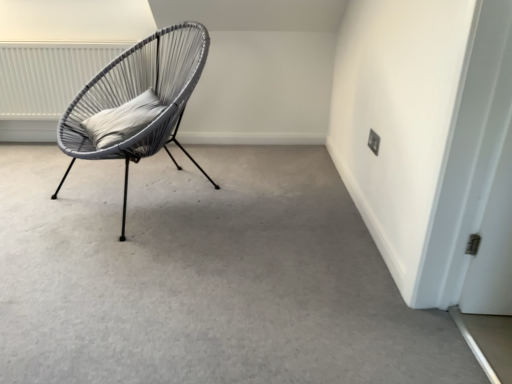
What do you see at coordinates (204, 276) in the screenshot? I see `matte gray carpet at center` at bounding box center [204, 276].

Locate an element on the screen. This screenshot has width=512, height=384. matte gray carpet at center is located at coordinates (204, 276).

What do you see at coordinates (122, 120) in the screenshot? I see `white soft cushion at center` at bounding box center [122, 120].

What is the approximate width of matte grey wicker chair at left?

It is 31.45 inches.

Locate an element on the screen. black plastic electric outlet at upper right is located at coordinates (373, 142).

Image resolution: width=512 pixels, height=384 pixels. What are the coordinates of `matte gray carpet at center` in the screenshot? It's located at (204, 276).

Is matte grey wicker chair at left oriented towards matte gray carpet at center?

No.

Considering the positions of point (166, 61) and point (337, 367), is point (166, 61) closer or farther from the camera than point (337, 367)?

Clearly, point (166, 61) is more distant from the camera than point (337, 367).

Considering the sizes of objects matte grey wicker chair at left and matte gray carpet at center in the image provided, who is taller, matte grey wicker chair at left or matte gray carpet at center?

Standing taller between the two is matte grey wicker chair at left.

Between matte grey wicker chair at left and matte gray carpet at center, which one has larger size?

Bigger between the two is matte grey wicker chair at left.

Which is closer, (378,142) or (139,107)?

The point (378,142) is more forward.

Who is more distant, black plastic electric outlet at upper right or white soft cushion at center?

black plastic electric outlet at upper right is more distant.

From their relative heights in the image, would you say black plastic electric outlet at upper right is taller or shorter than white soft cushion at center?

Clearly, black plastic electric outlet at upper right is shorter compared to white soft cushion at center.

How many degrees apart are the facing directions of black plastic electric outlet at upper right and white soft cushion at center?

There is a 28.9-degree angle between the facing directions of black plastic electric outlet at upper right and white soft cushion at center.

What's the angular difference between matte grey wicker chair at left and white textured radiator at upper left's facing directions?

The facing directions of matte grey wicker chair at left and white textured radiator at upper left are 38.6 degrees apart.

From the image's perspective, does matte grey wicker chair at left appear lower than white textured radiator at upper left?

Yes, from the image's perspective, matte grey wicker chair at left is below white textured radiator at upper left.

Measure the distance between matte grey wicker chair at left and white textured radiator at upper left.

They are 68.30 centimeters apart.

Which is behind, point (91, 157) or point (62, 77)?

The point (62, 77) is farther.

This screenshot has width=512, height=384. Find the location of `concrete below the white soft cushion at center (from a real-world perspective)`. concrete below the white soft cushion at center (from a real-world perspective) is located at coordinates (204, 276).

Looking at this image, which of these two, matte gray carpet at center or white soft cushion at center, is smaller?

With smaller size is white soft cushion at center.

Can you confirm if matte gray carpet at center is shorter than white soft cushion at center?

Correct, matte gray carpet at center is not as tall as white soft cushion at center.

Considering the sizes of objects white soft cushion at center and black plastic electric outlet at upper right in the image provided, who is smaller, white soft cushion at center or black plastic electric outlet at upper right?

black plastic electric outlet at upper right is smaller.

Looking at this image, how many degrees apart are the facing directions of white soft cushion at center and black plastic electric outlet at upper right?

The angle between the facing direction of white soft cushion at center and the facing direction of black plastic electric outlet at upper right is 28.9 degrees.

Is white soft cushion at center to the right of black plastic electric outlet at upper right from the viewer's perspective?

In fact, white soft cushion at center is to the left of black plastic electric outlet at upper right.

Measure the distance between white soft cushion at center and black plastic electric outlet at upper right.

white soft cushion at center and black plastic electric outlet at upper right are 1.17 meters apart from each other.

Can you confirm if black plastic electric outlet at upper right is positioned to the left of white textured radiator at upper left?

In fact, black plastic electric outlet at upper right is to the right of white textured radiator at upper left.

In the image, there is a black plastic electric outlet at upper right. Where is `radiator above it (from the image's perspective)`? radiator above it (from the image's perspective) is located at coordinates pyautogui.click(x=48, y=76).

Between black plastic electric outlet at upper right and white textured radiator at upper left, which one has smaller size?

black plastic electric outlet at upper right.

Is black plastic electric outlet at upper right completely or partially outside of white textured radiator at upper left?

black plastic electric outlet at upper right is positioned outside white textured radiator at upper left.

Is the position of white textured radiator at upper left less distant than that of matte grey wicker chair at left?

No, white textured radiator at upper left is further to the viewer.

Considering the positions of objects white textured radiator at upper left and matte grey wicker chair at left in the image provided, who is more to the right, white textured radiator at upper left or matte grey wicker chair at left?

matte grey wicker chair at left.

Which point is more forward, (32, 119) or (141, 46)?

The point (141, 46) is more forward.

Locate an element on the screen. Image resolution: width=512 pixels, height=384 pixels. concrete in front of the matte grey wicker chair at left is located at coordinates (204, 276).

At what (x,y) coordinates should I click in order to perform the action: click on electric outlet that appears below the white soft cushion at center (from the image's perspective). Please return your answer as a coordinate pair (x, y). The width and height of the screenshot is (512, 384). Looking at the image, I should click on (373, 142).

When comparing their distances from black plastic electric outlet at upper right, does white textured radiator at upper left or matte grey wicker chair at left seem closer?

matte grey wicker chair at left is closer to black plastic electric outlet at upper right.

Estimate the real-world distances between objects in this image. Which object is further from black plastic electric outlet at upper right, white soft cushion at center or matte grey wicker chair at left?

Among the two, white soft cushion at center is located further to black plastic electric outlet at upper right.

Estimate the real-world distances between objects in this image. Which object is further from matte grey wicker chair at left, white soft cushion at center or matte gray carpet at center?

Among the two, matte gray carpet at center is located further to matte grey wicker chair at left.

From the image, which object appears to be farther from matte grey wicker chair at left, black plastic electric outlet at upper right or white textured radiator at upper left?

black plastic electric outlet at upper right is positioned further to the anchor matte grey wicker chair at left.

Based on their spatial positions, is matte grey wicker chair at left or black plastic electric outlet at upper right further from white textured radiator at upper left?

black plastic electric outlet at upper right lies further to white textured radiator at upper left than the other object.

Estimate the real-world distances between objects in this image. Which object is further from white soft cushion at center, matte gray carpet at center or white textured radiator at upper left?

Among the two, white textured radiator at upper left is located further to white soft cushion at center.

Looking at the image, which one is located further to matte grey wicker chair at left, matte gray carpet at center or white textured radiator at upper left?

white textured radiator at upper left lies further to matte grey wicker chair at left than the other object.

From the picture: Looking at the image, which one is located closer to matte grey wicker chair at left, black plastic electric outlet at upper right or white soft cushion at center?

white soft cushion at center.

Identify the location of chair located between white textured radiator at upper left and black plastic electric outlet at upper right in the left-right direction. The width and height of the screenshot is (512, 384). (139, 94).

Identify the location of pillow positioned between matte grey wicker chair at left and white textured radiator at upper left from near to far. (122, 120).

Find the location of a particular element. chair between matte gray carpet at center and white soft cushion at center along the z-axis is located at coordinates (139, 94).

This screenshot has width=512, height=384. Find the location of `chair between matte gray carpet at center and black plastic electric outlet at upper right`. chair between matte gray carpet at center and black plastic electric outlet at upper right is located at coordinates (139, 94).